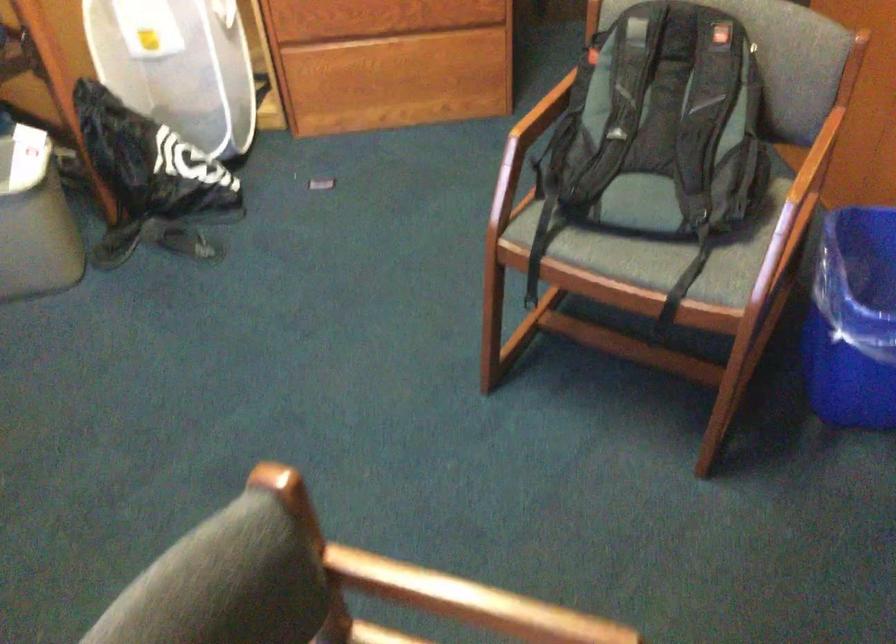
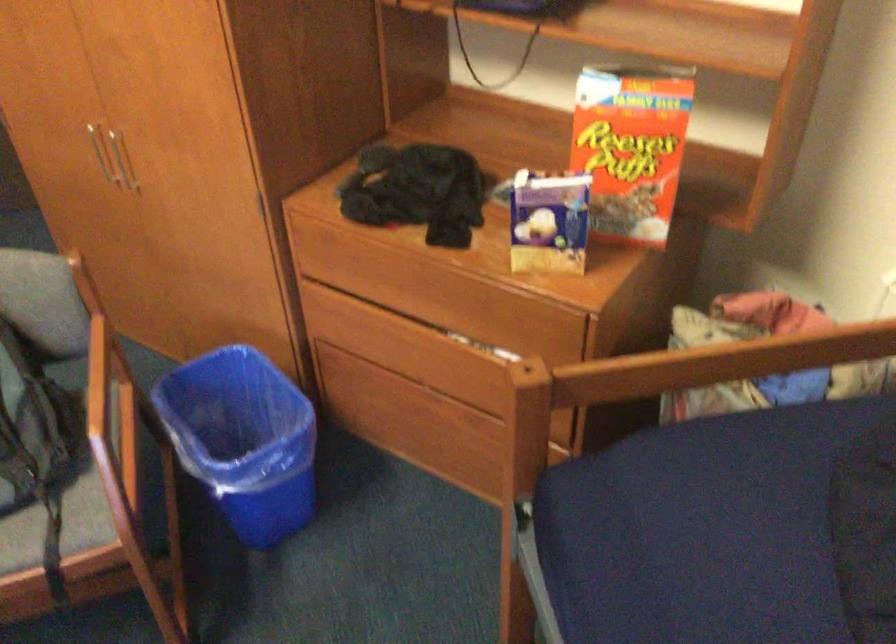
Question: Based on the continuous images, in which direction is the camera rotating? Reply with the corresponding letter.

Choices:
 (A) Left
 (B) Right
 (C) Up
 (D) Down

Answer: (B)